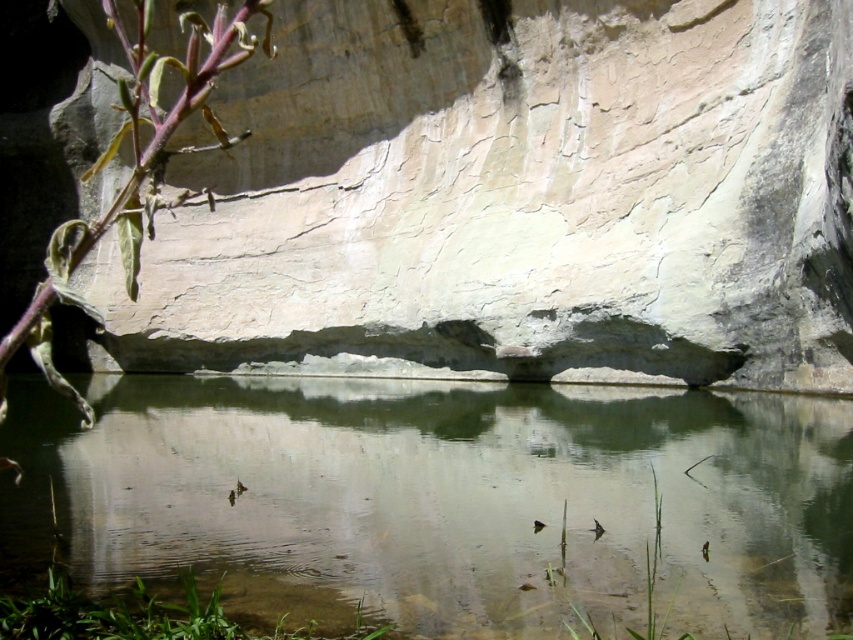
Describe the element at coordinates (448, 499) in the screenshot. I see `clear water at center` at that location.

Can you confirm if clear water at center is positioned below green leafy plant at lower left?

No.

Where is `clear water at center`? The height and width of the screenshot is (640, 853). clear water at center is located at coordinates (448, 499).

In order to click on clear water at center in this screenshot , I will do `click(448, 499)`.